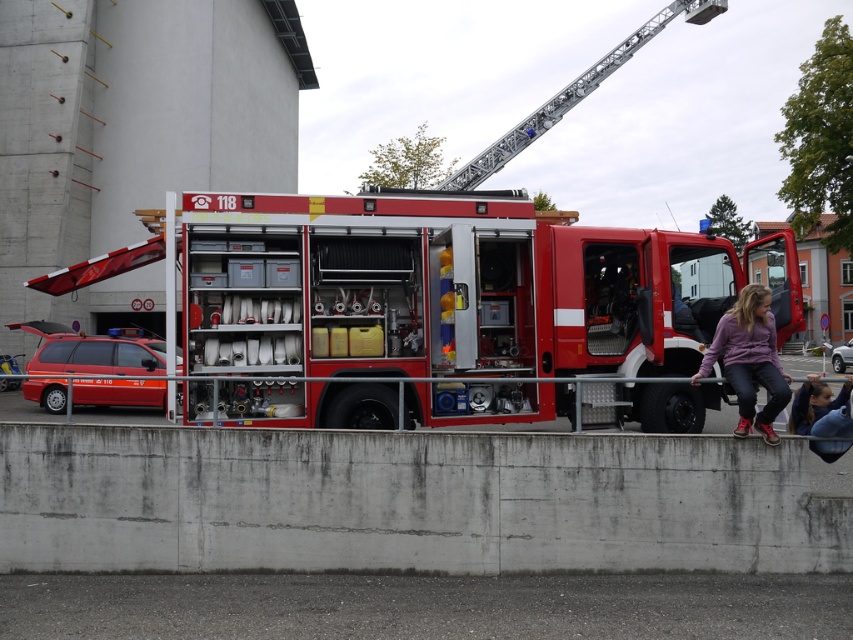
Who is higher up, metallic red car at left or metallic silver car at center?

metallic red car at left is above.

Is metallic red car at left further to camera compared to metallic silver car at center?

No, it is not.

Image resolution: width=853 pixels, height=640 pixels. I want to click on metallic red car at left, so pos(102,364).

Locate an element on the screen. metallic red fire truck at center is located at coordinates (430, 304).

Is metallic red fire truck at center taller than metallic silver car at center?

In fact, metallic red fire truck at center may be shorter than metallic silver car at center.

Does point (248, 262) come behind point (834, 355)?

No.

I want to click on metallic red fire truck at center, so click(430, 304).

Does point (190, 496) come closer to viewer compared to point (109, 368)?

Yes, point (190, 496) is in front of point (109, 368).

Between concrete at lower center and metallic red car at left, which one is positioned lower?

concrete at lower center is below.

Who is more forward, (51, 488) or (91, 387)?

Point (51, 488) is more forward.

Locate an element on the screen. concrete at lower center is located at coordinates (407, 500).